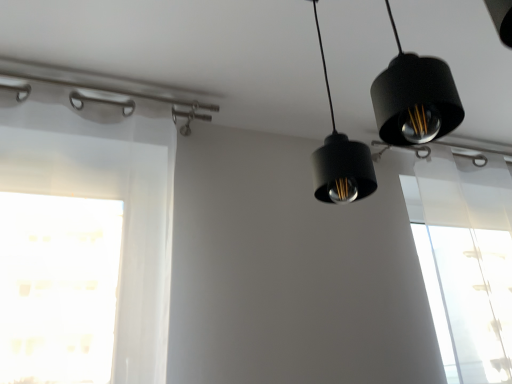
Question: Is black matte pendant light at upper center wider or thinner than transparent fabric at upper right?

Choices:
 (A) wide
 (B) thin

Answer: (A)

Question: In terms of height, does black matte pendant light at upper center look taller or shorter compared to transparent fabric at upper right?

Choices:
 (A) short
 (B) tall

Answer: (A)

Question: From a real-world perspective, is black matte pendant light at upper center physically located above or below transparent fabric at upper right?

Choices:
 (A) above
 (B) below

Answer: (A)

Question: Based on their sizes in the image, would you say transparent fabric at upper right is bigger or smaller than black matte pendant light at upper center?

Choices:
 (A) big
 (B) small

Answer: (A)

Question: From the image's perspective, is transparent fabric at upper right positioned above or below black matte pendant light at upper center?

Choices:
 (A) below
 (B) above

Answer: (A)

Question: Is point (453, 301) positioned closer to the camera than point (446, 76)?

Choices:
 (A) closer
 (B) farther

Answer: (B)

Question: Is transparent fabric at upper right taller or shorter than black matte pendant light at upper center?

Choices:
 (A) short
 (B) tall

Answer: (B)